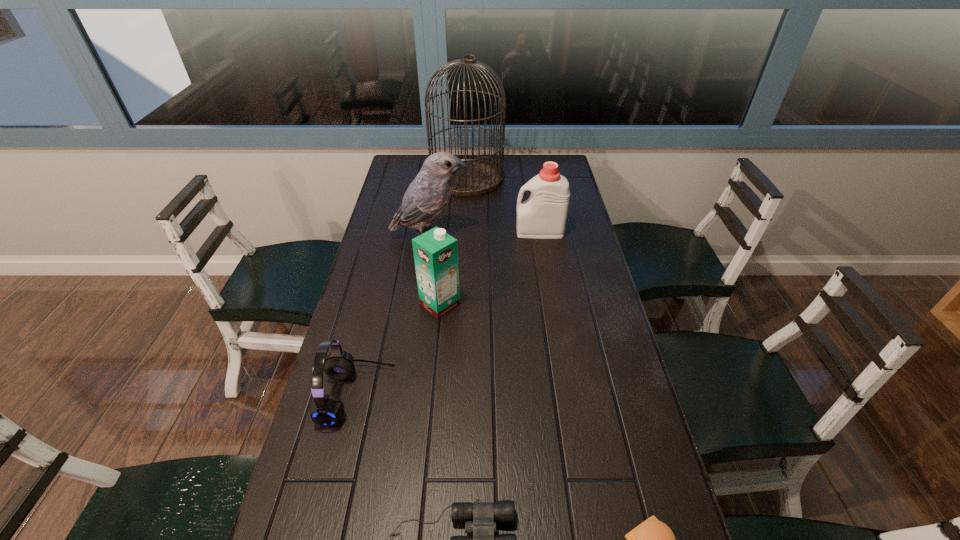
Image resolution: width=960 pixels, height=540 pixels. Identify the location of vacant space located on the handle side of the detergent. (458, 232).

Image resolution: width=960 pixels, height=540 pixels. I want to click on blank space located 0.120m on the handle side of the detergent, so click(x=481, y=232).

The width and height of the screenshot is (960, 540). I want to click on free location located 0.240m on the right of the fourth farthest object, so [x=542, y=305].

This screenshot has height=540, width=960. Identify the location of vacant space situated on the ear cushions of the third nearest object. (421, 396).

Locate an element on the screen. The height and width of the screenshot is (540, 960). object positioned at the far edge is located at coordinates (483, 175).

You are a GUI agent. You are given a task and a screenshot of the screen. Output one action in this format:
    pyautogui.click(x=<x>, y=<y>)
    Task: Click on the parrot located in the left edge section of the desktop
    The height and width of the screenshot is (540, 960).
    Given the screenshot: What is the action you would take?
    pyautogui.click(x=427, y=196)

Identify the location of headset situated at the left edge. Image resolution: width=960 pixels, height=540 pixels. (326, 410).

The height and width of the screenshot is (540, 960). I want to click on object at the right edge, so click(x=543, y=215).

At what (x,y) coordinates should I click in order to perform the action: click on free space at the left edge of the desktop. Please return your answer as a coordinate pair (x, y). This screenshot has width=960, height=540. Looking at the image, I should click on (324, 442).

This screenshot has width=960, height=540. I want to click on vacant area at the right edge of the desktop, so click(576, 328).